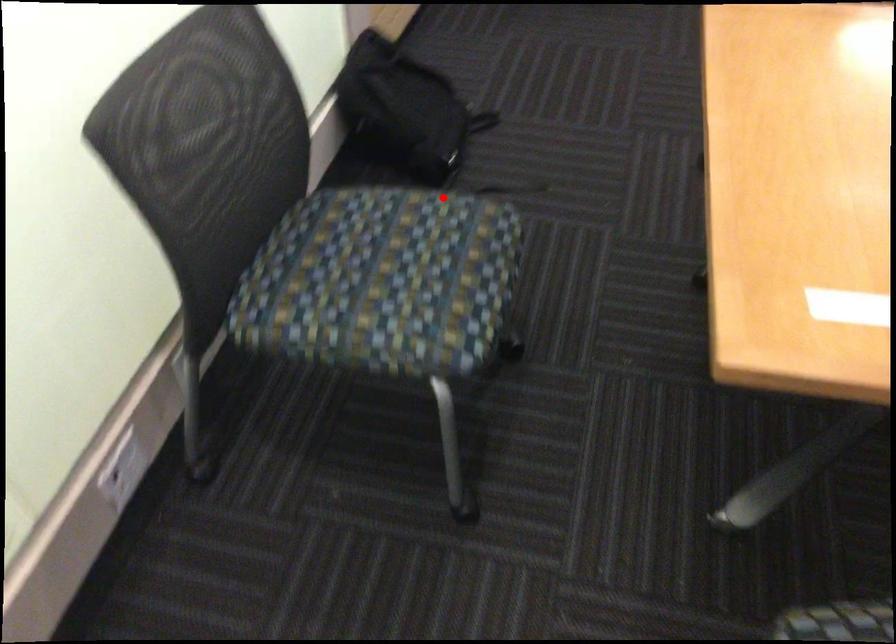
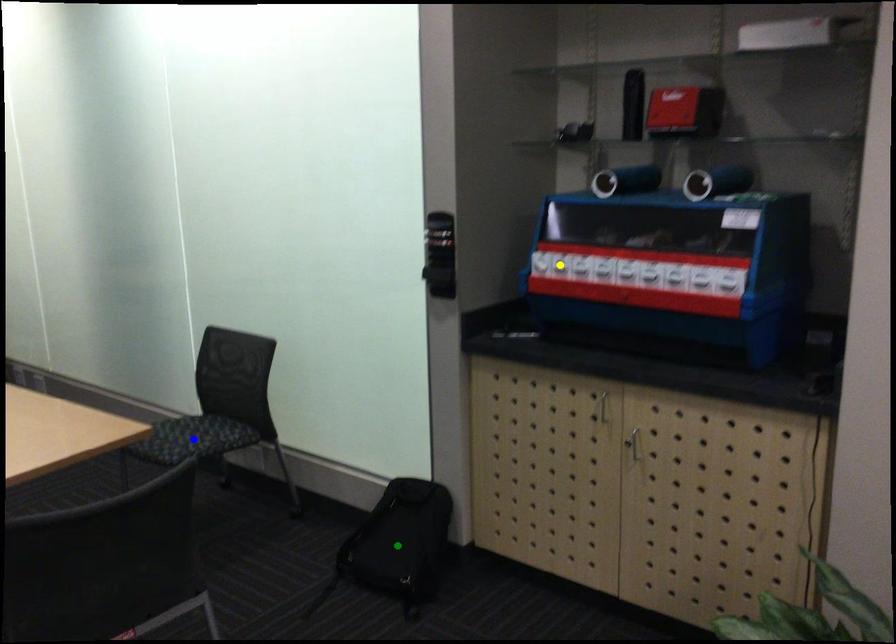
Question: I am providing you with two images of the same scene from different viewpoints. A red point is marked on the first image. You are given multiple points on the second image. Which mark in image 2 goes with the point in image 1?

Choices:
 (A) blue point
 (B) green point
 (C) yellow point

Answer: (A)